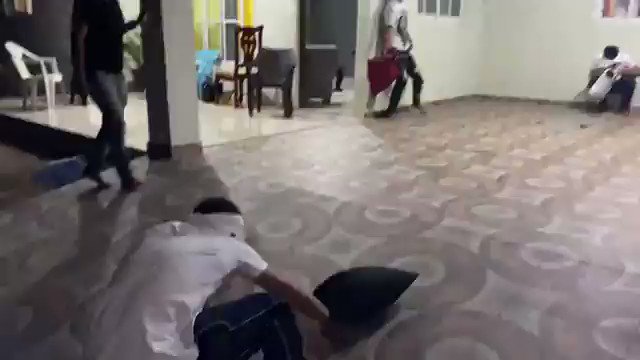
You are a GUI agent. You are given a task and a screenshot of the screen. Output one action in this format:
    pyautogui.click(x=<x>, y=<y>)
    Task: Click on the window
    
    Given the screenshot: What is the action you would take?
    pyautogui.click(x=216, y=31)